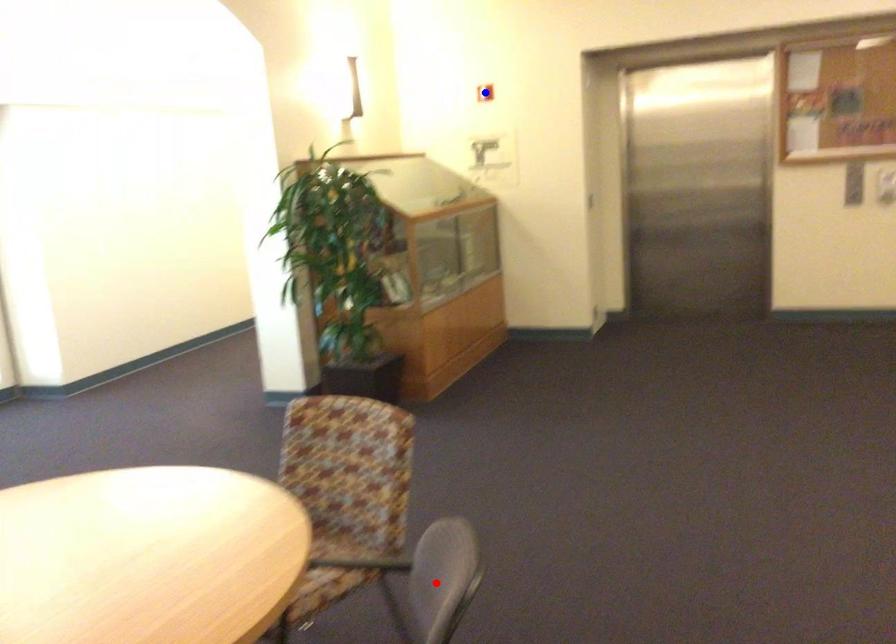
Question: In the image, two points are highlighted. Which point is nearer to the camera? Reply with the corresponding letter.

Choices:
 (A) blue point
 (B) red point

Answer: (B)